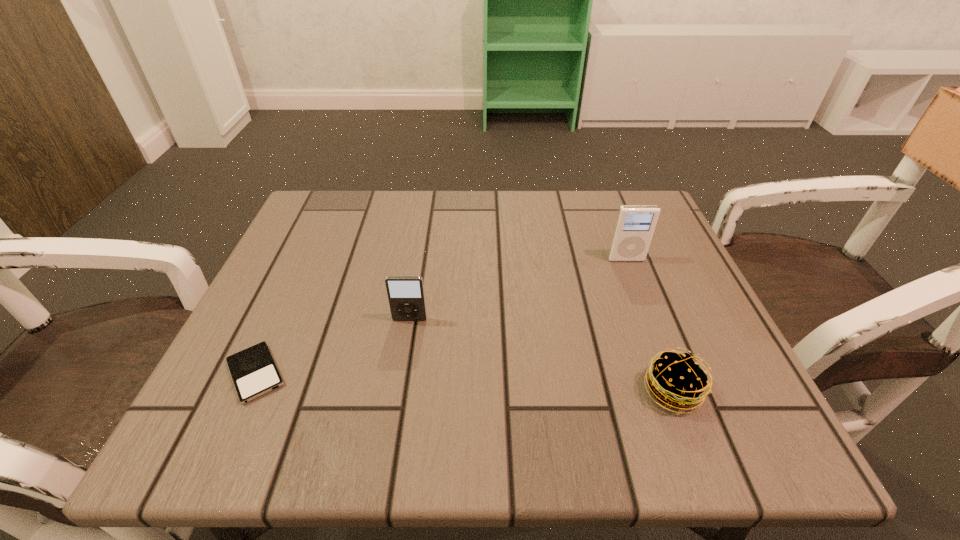
In the image, there is a desktop. At what (x,y) coordinates should I click in order to perform the action: click on free region at the left edge. Please return your answer as a coordinate pair (x, y). This screenshot has height=540, width=960. Looking at the image, I should click on (277, 303).

In the image, there is a desktop. Where is `vacant area at the right edge`? The height and width of the screenshot is (540, 960). vacant area at the right edge is located at coordinates (637, 303).

This screenshot has height=540, width=960. In the image, there is a desktop. What are the coordinates of `vacant space at the far left corner` in the screenshot? It's located at (311, 218).

At what (x,y) coordinates should I click in order to perform the action: click on vacant region at the near left corner of the desktop. Please return your answer as a coordinate pair (x, y). Looking at the image, I should click on (186, 455).

Where is `blank space at the near right corner`? This screenshot has width=960, height=540. blank space at the near right corner is located at coordinates click(750, 420).

Find the location of a particular element. vacant area that lies between the leftmost iPod and the third tallest object is located at coordinates (465, 382).

The image size is (960, 540). Identify the location of vacant area that lies between the leftmost object and the farthest object. (441, 316).

Identify the location of free space between the leftmost iPod and the second farthest object. (333, 347).

The image size is (960, 540). Find the location of `free space between the shortest object and the third tallest object`. free space between the shortest object and the third tallest object is located at coordinates (465, 382).

Locate an element on the screen. This screenshot has width=960, height=540. vacant space that is in between the tallest iPod and the third object from right to left is located at coordinates (517, 289).